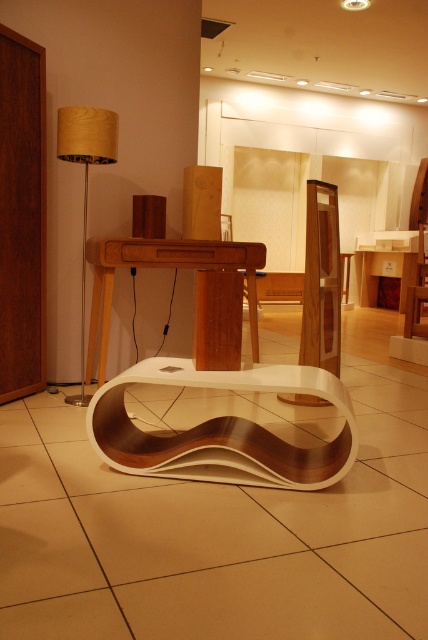
Is white glossy coffee table at center wider than wooden fabric lampshade at left?

Yes, white glossy coffee table at center is wider than wooden fabric lampshade at left.

At what (x,y) coordinates should I click in order to perform the action: click on white glossy coffee table at center. Please return your answer as a coordinate pair (x, y). Looking at the image, I should click on (222, 429).

This screenshot has height=640, width=428. I want to click on white glossy coffee table at center, so click(x=222, y=429).

Does white glossy table at center appear over wooden fabric lampshade at left?

No, white glossy table at center is not above wooden fabric lampshade at left.

Which is above, white glossy table at center or wooden fabric lampshade at left?

wooden fabric lampshade at left

Measure the distance between point (91, 260) and camera.

Point (91, 260) is 11.48 feet away from camera.

The width and height of the screenshot is (428, 640). In order to click on white glossy table at center in this screenshot , I will do point(160,266).

Can you confirm if white glossy table at center is taller than matte wood table at center?

Incorrect, white glossy table at center's height is not larger of matte wood table at center's.

Where is `white glossy table at center`? The width and height of the screenshot is (428, 640). white glossy table at center is located at coordinates (160, 266).

Locate an element on the screen. Image resolution: width=428 pixels, height=640 pixels. white glossy table at center is located at coordinates [x=160, y=266].